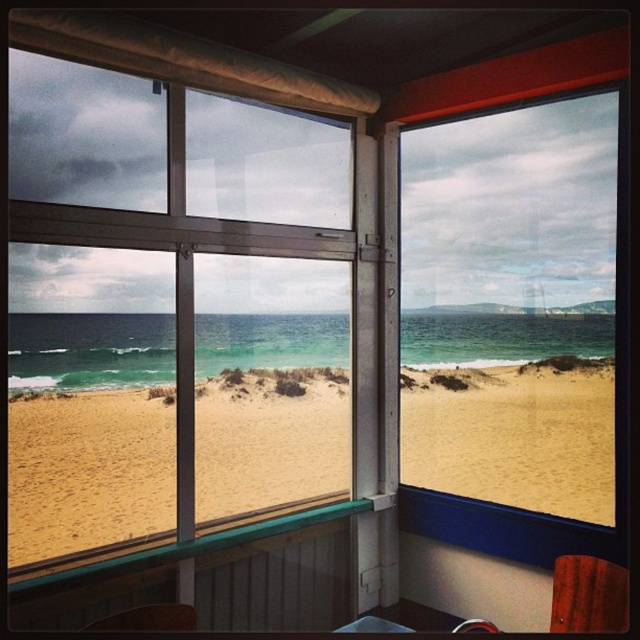
You are inside a bus with large windows and want to look at the beach outside. There is a specific point marked at coordinates point (248,218) that you want to focus on. If your eyes are 1.7 meters above the ground and the window is 1.8 meters tall, can you see that point through the window?

The distance of point (248,218) from viewer is 2.67 meters. Since the window is 1.8 meters tall and your eyes are 1.7 meters above the ground, you can see the point as it is within the window height range.

In the scene shown: You are sitting in a vehicle with a panoramic view. You notice a transparent glass window at center and a matte black chair at lower left. Which object is closer to you, the observer?

The matte black chair at lower left is behind transparent glass window at center, so the transparent glass window at center is closer to you.